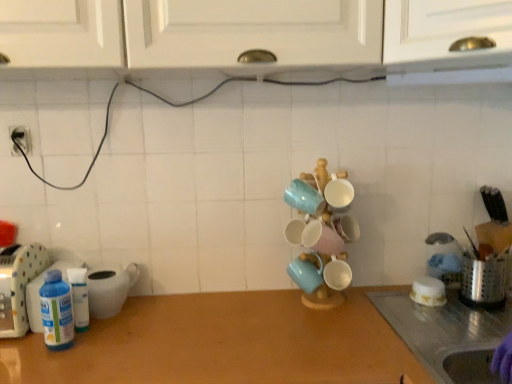
What do you see at coordinates (428, 292) in the screenshot? The width and height of the screenshot is (512, 384). I see `white glossy bowl at right, which appears as the first tableware when viewed from the right` at bounding box center [428, 292].

The height and width of the screenshot is (384, 512). What are the coordinates of `translucent plastic bottles at left, acting as the 3th appliance starting from the right` in the screenshot? It's located at (42, 283).

What do you see at coordinates (42, 283) in the screenshot?
I see `translucent plastic bottles at left, the 2th appliance viewed from the left` at bounding box center [42, 283].

What do you see at coordinates (321, 236) in the screenshot?
I see `matte ceramic mugs at center, the second tableware viewed from the left` at bounding box center [321, 236].

Describe the element at coordinates (252, 34) in the screenshot. The width and height of the screenshot is (512, 384). I see `white glossy cabinet at upper center` at that location.

What is the approximate width of matte blue mug at center, the 3th tableware from the right?

The width of matte blue mug at center, the 3th tableware from the right, is 4.03 inches.

Image resolution: width=512 pixels, height=384 pixels. What do you see at coordinates (110, 289) in the screenshot? I see `white plastic container at left, positioned as the 3th appliance in left-to-right order` at bounding box center [110, 289].

Image resolution: width=512 pixels, height=384 pixels. In order to click on white glossy bowl at right, which appears as the first tableware when viewed from the right in this screenshot , I will do `click(428, 292)`.

Is translucent plastic bottles at left, the 2th appliance viewed from the left, located within metallic silver utensil holder at right, the 4th appliance positioned from the left?

That's incorrect, translucent plastic bottles at left, the 2th appliance viewed from the left, is not inside metallic silver utensil holder at right, the 4th appliance positioned from the left.

From the image's perspective, relative to translucent plastic bottles at left, the 2th appliance viewed from the left, is metallic silver utensil holder at right, the 4th appliance positioned from the left, above or below?

Based on their image positions, metallic silver utensil holder at right, the 4th appliance positioned from the left, is located above translucent plastic bottles at left, the 2th appliance viewed from the left.

Which is in front, point (471, 304) or point (26, 292)?

The point (26, 292) is more forward.

From the image's perspective, which one is positioned higher, translucent plastic bottles at left, acting as the 3th appliance starting from the right, or white glossy cabinet at upper center?

white glossy cabinet at upper center is shown above in the image.

Based on the photo, is white glossy cabinet at upper center at the back of translucent plastic bottles at left, the 2th appliance viewed from the left?

That's not correct — translucent plastic bottles at left, the 2th appliance viewed from the left, is not looking away from white glossy cabinet at upper center.

Locate an element on the screen. cabinetry on the right of translucent plastic bottles at left, acting as the 3th appliance starting from the right is located at coordinates pyautogui.click(x=252, y=34).

Considering the relative positions of translucent plastic bottles at left, acting as the 3th appliance starting from the right, and white glossy cabinet at upper center in the image provided, is translucent plastic bottles at left, acting as the 3th appliance starting from the right, behind white glossy cabinet at upper center?

Yes.

How much distance is there between purple rubber glove at lower right and white plastic container at left, positioned as the 3th appliance in left-to-right order?

purple rubber glove at lower right is 1.00 meters from white plastic container at left, positioned as the 3th appliance in left-to-right order.

From the image's perspective, is purple rubber glove at lower right positioned above or below white plastic container at left, which appears as the second appliance when viewed from the right?

Based on their image positions, purple rubber glove at lower right is located beneath white plastic container at left, which appears as the second appliance when viewed from the right.

Is point (510, 370) less distant than point (128, 278)?

Yes, it is in front of point (128, 278).

Considering the positions of objects purple rubber glove at lower right and white plastic container at left, which appears as the second appliance when viewed from the right, in the image provided, who is more to the left, purple rubber glove at lower right or white plastic container at left, which appears as the second appliance when viewed from the right,?

white plastic container at left, which appears as the second appliance when viewed from the right.

Can you tell me how much white plastic bottle at left, the 1th appliance in the left-to-right sequence, and white plastic container at left, which appears as the second appliance when viewed from the right, differ in facing direction?

The facing directions of white plastic bottle at left, the 1th appliance in the left-to-right sequence, and white plastic container at left, which appears as the second appliance when viewed from the right, are 2.05 degrees apart.

From the picture: Who is shorter, white plastic bottle at left, which is counted as the fourth appliance, starting from the right, or white plastic container at left, positioned as the 3th appliance in left-to-right order?

With less height is white plastic container at left, positioned as the 3th appliance in left-to-right order.

Considering the sizes of white plastic bottle at left, the 1th appliance in the left-to-right sequence, and white plastic container at left, positioned as the 3th appliance in left-to-right order, in the image, is white plastic bottle at left, the 1th appliance in the left-to-right sequence, bigger or smaller than white plastic container at left, positioned as the 3th appliance in left-to-right order,?

Considering their sizes, white plastic bottle at left, the 1th appliance in the left-to-right sequence, takes up more space than white plastic container at left, positioned as the 3th appliance in left-to-right order.

At what (x,y) coordinates should I click in order to perform the action: click on the 3rd appliance in front when counting from the white plastic container at left, positioned as the 3th appliance in left-to-right order. Please return your answer as a coordinate pair (x, y). Looking at the image, I should click on (18, 286).

From a real-world perspective, is white plastic bottle at left, the 1th appliance in the left-to-right sequence, beneath matte blue mug at center, the 3th tableware from the right?

No.

Which object is wider, white plastic bottle at left, the 1th appliance in the left-to-right sequence, or matte blue mug at center, the 3th tableware from the right?

white plastic bottle at left, the 1th appliance in the left-to-right sequence, is wider.

Is matte blue mug at center, the 3th tableware from the right, surrounded by white plastic bottle at left, which is counted as the fourth appliance, starting from the right?

No, matte blue mug at center, the 3th tableware from the right, is not surrounded by white plastic bottle at left, which is counted as the fourth appliance, starting from the right.

Considering the sizes of objects white plastic bottle at left, the 1th appliance in the left-to-right sequence, and matte blue mug at center, the first tableware viewed from the left, in the image provided, who is taller, white plastic bottle at left, the 1th appliance in the left-to-right sequence, or matte blue mug at center, the first tableware viewed from the left,?

With more height is white plastic bottle at left, the 1th appliance in the left-to-right sequence.

Which of these two, translucent plastic bottles at left, acting as the 3th appliance starting from the right, or wooden at center, stands shorter?

With less height is wooden at center.

From a real-world perspective, which is physically above, translucent plastic bottles at left, acting as the 3th appliance starting from the right, or wooden at center?

In real-world perspective, translucent plastic bottles at left, acting as the 3th appliance starting from the right, is above.

From the image's perspective, is translucent plastic bottles at left, acting as the 3th appliance starting from the right, on wooden at center?

Correct, translucent plastic bottles at left, acting as the 3th appliance starting from the right, appears higher than wooden at center in the image.

Between translucent plastic bottles at left, acting as the 3th appliance starting from the right, and wooden at center, which one has larger width?

Wider between the two is wooden at center.

Would you consider matte ceramic mugs at center, the second tableware viewed from the right, to be distant from white plastic container at left, positioned as the 3th appliance in left-to-right order?

No, there isn't a large distance between matte ceramic mugs at center, the second tableware viewed from the right, and white plastic container at left, positioned as the 3th appliance in left-to-right order.

From a real-world perspective, which object rests below the other?

From a 3D spatial view, white plastic container at left, which appears as the second appliance when viewed from the right, is below.

From the image's perspective, relative to white plastic container at left, positioned as the 3th appliance in left-to-right order, is matte ceramic mugs at center, the second tableware viewed from the right, above or below?

Clearly, from the image's perspective, matte ceramic mugs at center, the second tableware viewed from the right, is above white plastic container at left, positioned as the 3th appliance in left-to-right order.

Which appliance is the 2nd one when counting from the right side of the translucent plastic bottles at left, the 2th appliance viewed from the left? Please provide its 2D coordinates.

[(485, 281)]

I want to click on the 2nd appliance behind the white glossy cabinet at upper center, so click(42, 283).

Looking at the image, which one is located closer to wooden at center, matte ceramic mugs at center, the second tableware viewed from the left, or purple rubber glove at lower right?

matte ceramic mugs at center, the second tableware viewed from the left, lies closer to wooden at center than the other object.

Which object lies nearer to the anchor point white plastic container at left, positioned as the 3th appliance in left-to-right order, translucent plastic bottle at left or white glossy cabinet at upper center?

translucent plastic bottle at left.

From the image, which object appears to be farther from matte blue mug at center, the first tableware viewed from the left, white plastic container at left, positioned as the 3th appliance in left-to-right order, or white plastic bottle at left, the 1th appliance in the left-to-right sequence?

white plastic bottle at left, the 1th appliance in the left-to-right sequence, is positioned further to the anchor matte blue mug at center, the first tableware viewed from the left.

Which object lies nearer to the anchor point white plastic container at left, positioned as the 3th appliance in left-to-right order, white glossy cabinet at upper center or matte blue mug at center, the 3th tableware from the right?

matte blue mug at center, the 3th tableware from the right, is closer to white plastic container at left, positioned as the 3th appliance in left-to-right order.

Based on their spatial positions, is wooden at center or matte ceramic mugs at center, the second tableware viewed from the right, further from white glossy cabinet at upper center?

Among the two, wooden at center is located further to white glossy cabinet at upper center.

Based on their spatial positions, is purple rubber glove at lower right or white glossy cabinet at upper center further from matte blue mug at center, the first tableware viewed from the left?

Based on the image, white glossy cabinet at upper center appears to be further to matte blue mug at center, the first tableware viewed from the left.

Considering their positions, is purple rubber glove at lower right positioned further to metallic silver utensil holder at right, the first appliance from the right, than matte ceramic mugs at center, the second tableware viewed from the right?

matte ceramic mugs at center, the second tableware viewed from the right, is positioned further to the anchor metallic silver utensil holder at right, the first appliance from the right.

Estimate the real-world distances between objects in this image. Which object is closer to white plastic container at left, positioned as the 3th appliance in left-to-right order, matte ceramic mugs at center, the second tableware viewed from the right, or translucent plastic bottle at left?

The object closer to white plastic container at left, positioned as the 3th appliance in left-to-right order, is translucent plastic bottle at left.

The width and height of the screenshot is (512, 384). Identify the location of tableware between white glossy cabinet at upper center and matte blue mug at center, the 3th tableware from the right, in the vertical direction. (321, 236).

Image resolution: width=512 pixels, height=384 pixels. What are the coordinates of `countertop between translucent plastic bottle at left and white glossy bowl at right, which is counted as the third tableware, starting from the left` in the screenshot? It's located at (224, 343).

Locate an element on the screen. This screenshot has height=384, width=512. hand situated between translucent plastic bottles at left, the 2th appliance viewed from the left, and metallic silver utensil holder at right, the 4th appliance positioned from the left, from left to right is located at coordinates (503, 360).

At what (x,y) coordinates should I click in order to perform the action: click on bottle that lies between white glossy cabinet at upper center and white plastic container at left, which appears as the second appliance when viewed from the right, from top to bottom. Please return your answer as a coordinate pair (x, y). This screenshot has height=384, width=512. Looking at the image, I should click on (56, 311).